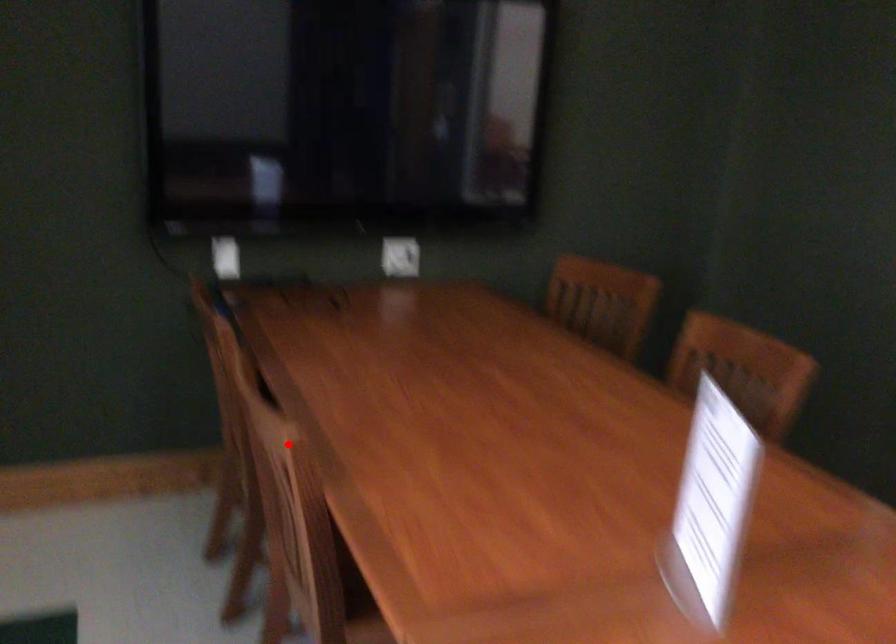
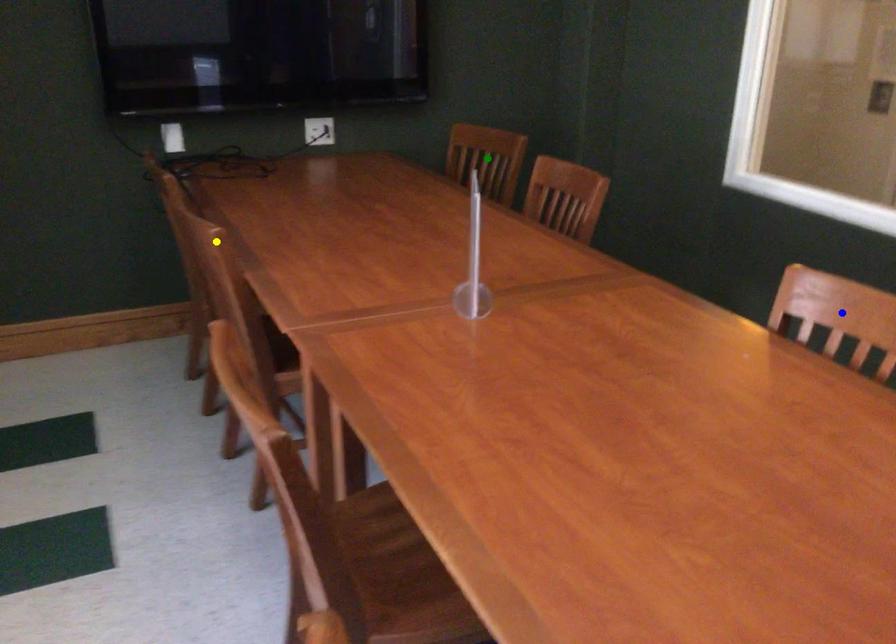
Question: I am providing you with two images of the same scene from different viewpoints. A red point is marked on the first image. You are given multiple points on the second image. Which point in image 2 is actually the same real-world point as the red point in image 1?

Choices:
 (A) green point
 (B) blue point
 (C) yellow point

Answer: (C)